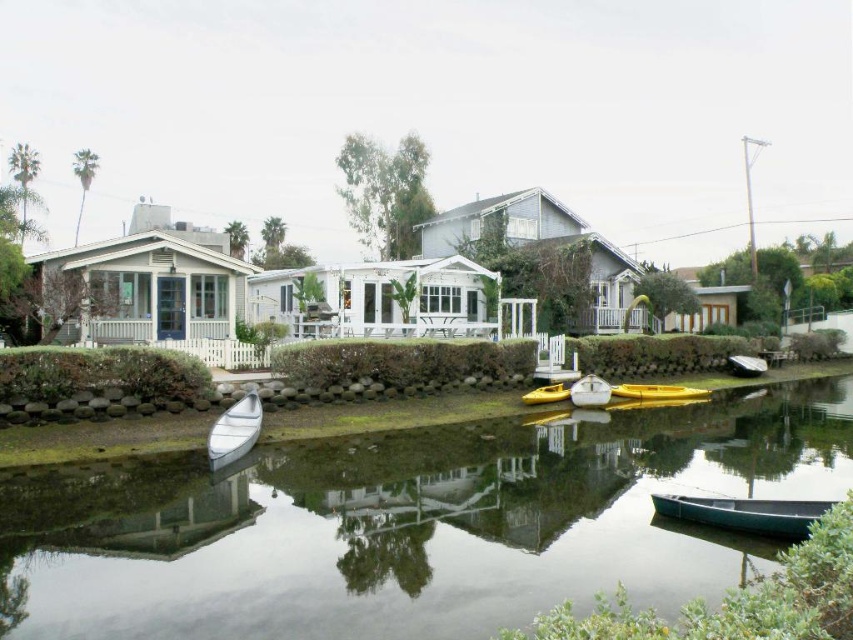
In the scene shown: You are planning to store the green matte canoe at lower right and the white glossy boat at lower left in a storage shed. The shed has a space that can only accommodate the smaller of the two. Which boat should you store there?

The green matte canoe at lower right is smaller than the white glossy boat at lower left, so you should store the green matte canoe at lower right in the shed.

You are standing at the edge of the canal and want to reach a specific point marked in the image. The point is located at coordinates point [729,529]. If your maximum reach is 25 feet, can you touch this point without moving?

The point [729,529] is 30.47 feet away from the viewer, which exceeds your maximum reach of 25 feet. Therefore, you cannot touch it without moving.

You are planning to rent a canoe for a short trip on the canal. You see the green matte canoe at lower right and the yellow matte canoe at center. Which one is larger and more suitable for carrying more gear?

The yellow matte canoe at center is larger than the green matte canoe at lower right, so it is more suitable for carrying more gear.